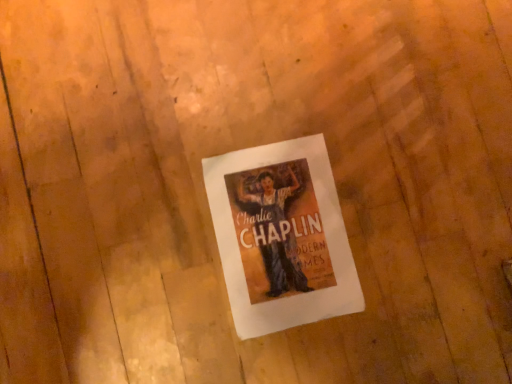
The height and width of the screenshot is (384, 512). In order to click on vacant area to the left of white paper at center in this screenshot , I will do `click(161, 168)`.